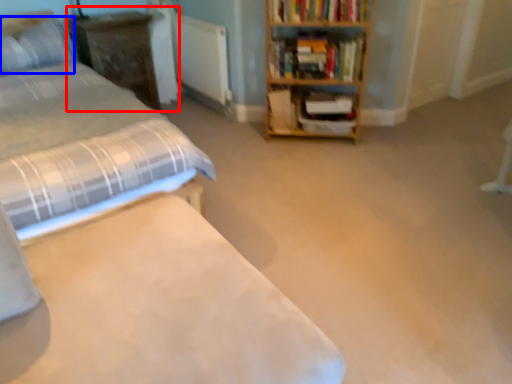
Question: Which object is closer to the camera taking this photo, dresser (highlighted by a red box) or pillow (highlighted by a blue box)?

Choices:
 (A) dresser
 (B) pillow

Answer: (B)